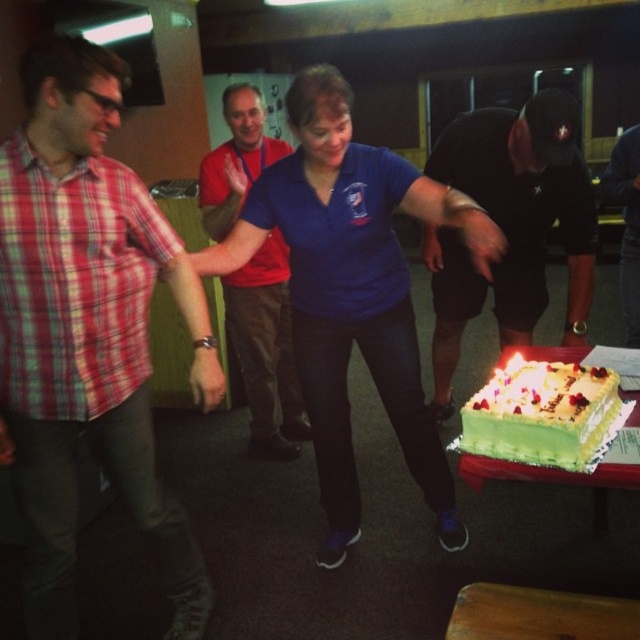
Who is lower down, matte red shirt at center or black cotton t-shirt at center?

matte red shirt at center

Identify the location of matte red shirt at center. (266, 349).

Who is lower down, black matte shorts at lower right or matte red shirt at center?

matte red shirt at center

Can you confirm if black matte shorts at lower right is positioned above matte red shirt at center?

Yes.

Is point (474, 285) positioned before point (252, 269)?

No, (474, 285) is further to viewer.

Where is `black matte shorts at lower right`? The width and height of the screenshot is (640, 640). black matte shorts at lower right is located at coordinates tap(509, 225).

Can you confirm if blue cotton shirt at center is positioned to the left of black cotton t-shirt at center?

Correct, you'll find blue cotton shirt at center to the left of black cotton t-shirt at center.

Is blue cotton shirt at center smaller than black cotton t-shirt at center?

Incorrect, blue cotton shirt at center is not smaller in size than black cotton t-shirt at center.

Where is `blue cotton shirt at center`? Image resolution: width=640 pixels, height=640 pixels. blue cotton shirt at center is located at coordinates (353, 291).